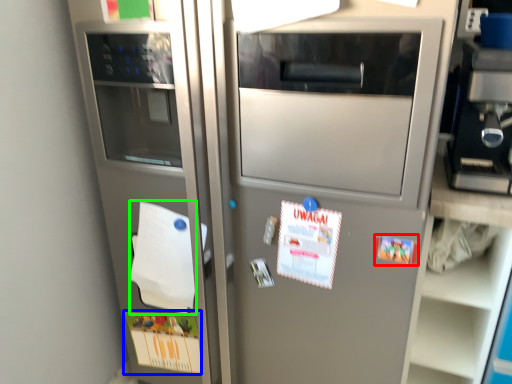
Question: Considering the real-world distances, which object is farthest from postcard (highlighted by a red box)? postcard (highlighted by a blue box) or notepad (highlighted by a green box)?

Choices:
 (A) postcard
 (B) notepad

Answer: (A)